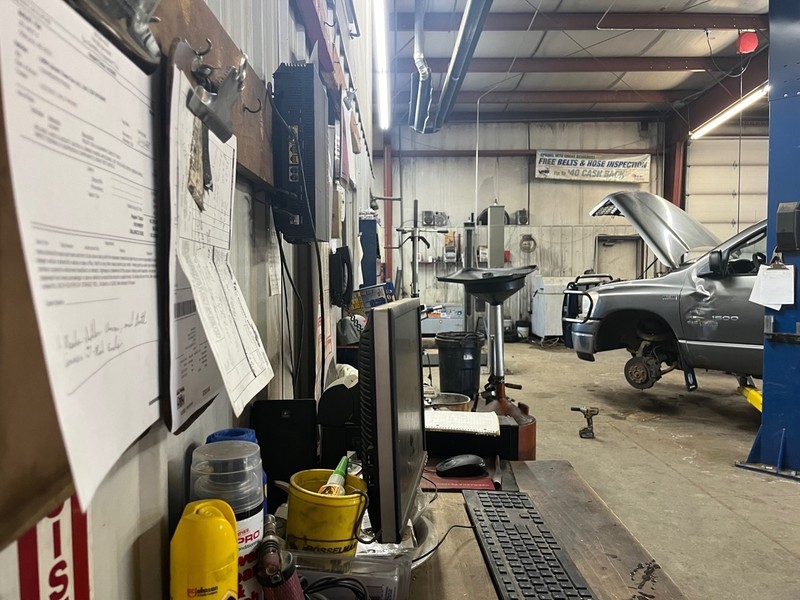
Where is `keyboard`? Image resolution: width=800 pixels, height=600 pixels. keyboard is located at coordinates (530, 580).